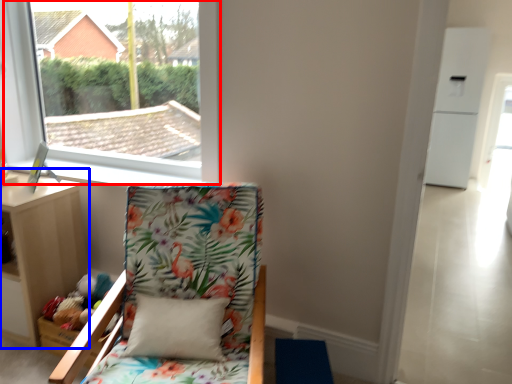
Question: Among these objects, which one is nearest to the camera, window (highlighted by a red box) or nightstand (highlighted by a blue box)?

Choices:
 (A) window
 (B) nightstand

Answer: (A)